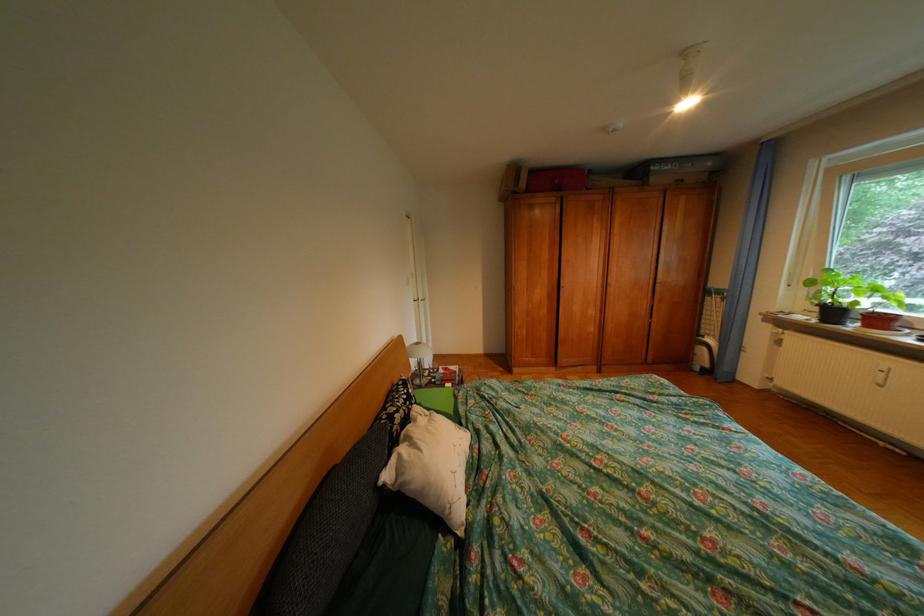
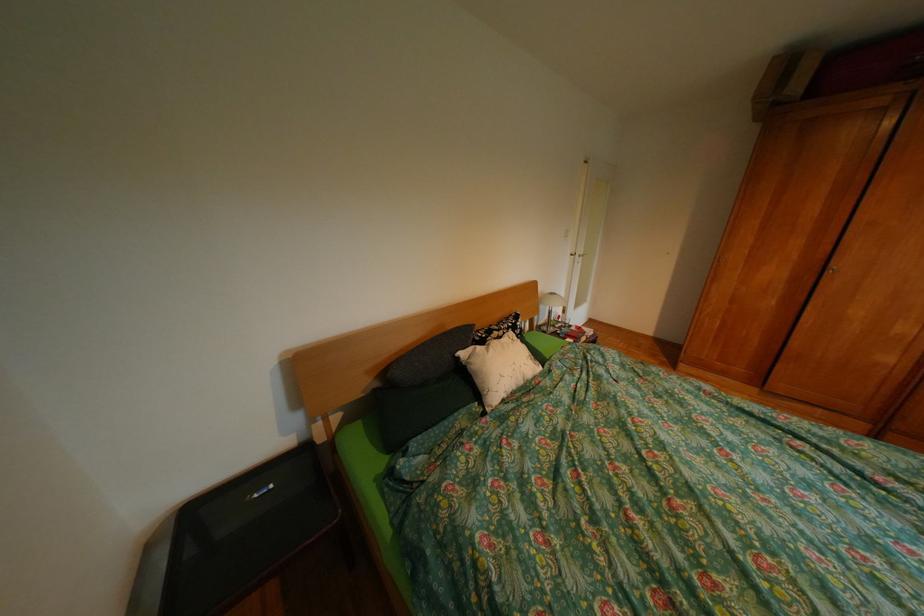
The point at [402,477] is marked in the first image. Where is the corresponding point in the second image?

(477, 354)